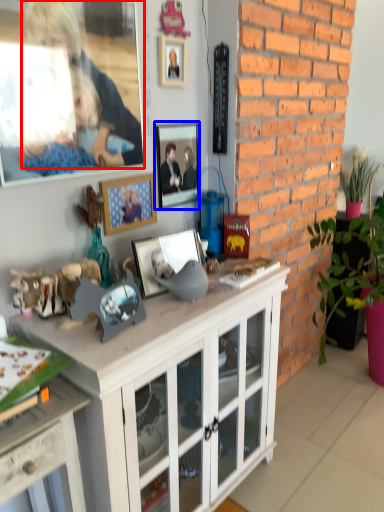
Question: Which point is further to the camera, person (highlighted by a red box) or picture frame (highlighted by a blue box)?

Choices:
 (A) person
 (B) picture frame

Answer: (B)